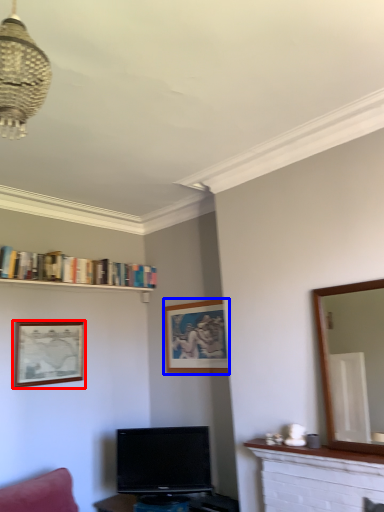
Question: Which of the following is the farthest to the observer, picture frame (highlighted by a red box) or picture frame (highlighted by a blue box)?

Choices:
 (A) picture frame
 (B) picture frame

Answer: (B)